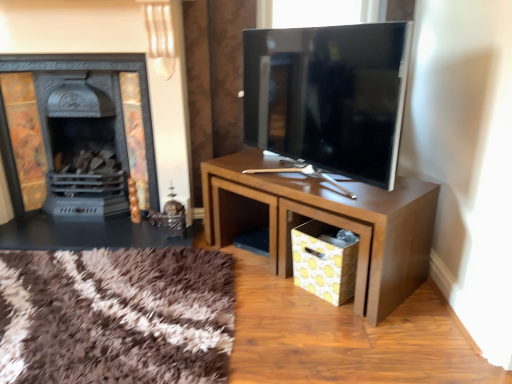
At what (x,y) coordinates should I click in order to perform the action: click on free space in front of brown wood table at center. Please return your answer as a coordinate pair (x, y). This screenshot has height=384, width=512. Looking at the image, I should click on (325, 332).